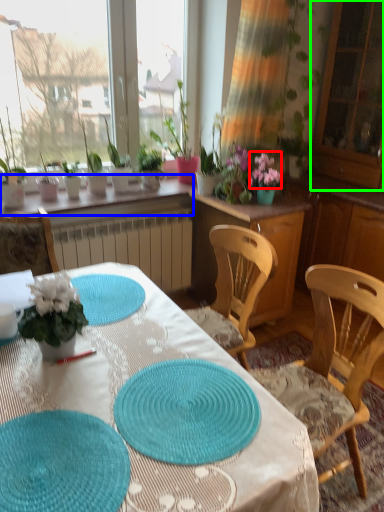
Question: Which object is positioned farthest from flower (highlighted by a red box)? Select from window sill (highlighted by a blue box) and screen door (highlighted by a green box).

Choices:
 (A) window sill
 (B) screen door

Answer: (B)